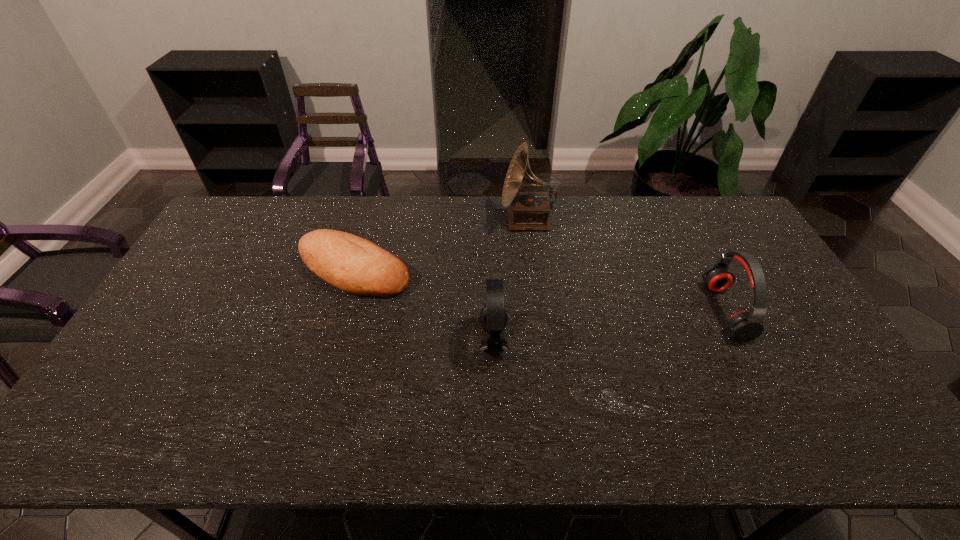
The height and width of the screenshot is (540, 960). I want to click on vacant space located on the ear cups of the third object from right to left, so click(x=372, y=341).

Locate an element on the screen. The image size is (960, 540). vacant space located 0.100m on the ear cups of the third object from right to left is located at coordinates (442, 341).

Where is `vacant position located on the ear cups of the rightmost object`? Image resolution: width=960 pixels, height=540 pixels. vacant position located on the ear cups of the rightmost object is located at coordinates (594, 310).

Locate an element on the screen. Image resolution: width=960 pixels, height=540 pixels. free region located 0.100m on the ear cups of the rightmost object is located at coordinates (677, 310).

Locate an element on the screen. free space located 0.220m on the ear cups of the rightmost object is located at coordinates (636, 310).

I want to click on free space located 0.380m on the right of the leftmost object, so click(x=532, y=271).

Find the location of a particular element. object that is at the far edge is located at coordinates (529, 211).

The image size is (960, 540). In the image, there is a desktop. What are the coordinates of `blank space at the far edge` in the screenshot? It's located at (695, 235).

I want to click on vacant space at the near edge, so coord(482,421).

The height and width of the screenshot is (540, 960). Identify the location of free location at the right edge. (732, 238).